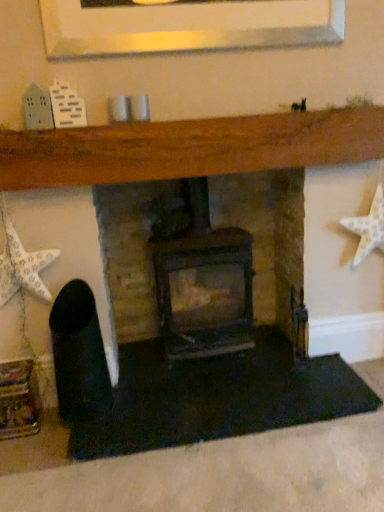
This screenshot has height=512, width=384. Describe the element at coordinates (22, 267) in the screenshot. I see `white paper star at left, which appears as the second starfish when viewed from the right` at that location.

What is the approximate width of white matte starfish at right, the 1th starfish from the right?

white matte starfish at right, the 1th starfish from the right, is 3.70 inches in width.

Describe the element at coordinates (189, 147) in the screenshot. The image size is (384, 512). I see `rustic stone fireplace at center` at that location.

Locate an element on the screen. The width and height of the screenshot is (384, 512). white paper star at left, which appears as the second starfish when viewed from the right is located at coordinates (22, 267).

Considering the sizes of objects dark brown wood burning stove at center and white matte starfish at right, the 2th starfish positioned from the left, in the image provided, who is smaller, dark brown wood burning stove at center or white matte starfish at right, the 2th starfish positioned from the left,?

With smaller size is white matte starfish at right, the 2th starfish positioned from the left.

Can you confirm if dark brown wood burning stove at center is shorter than white matte starfish at right, the 1th starfish from the right?

In fact, dark brown wood burning stove at center may be taller than white matte starfish at right, the 1th starfish from the right.

Can you confirm if dark brown wood burning stove at center is positioned to the left of white matte starfish at right, the 1th starfish from the right?

Correct, you'll find dark brown wood burning stove at center to the left of white matte starfish at right, the 1th starfish from the right.

Consider the image. From a real-world perspective, which object stands above the other?

white matte starfish at right, the 2th starfish positioned from the left, is physically above.

From the image's perspective, who appears lower, rustic stone fireplace at center or white matte starfish at right, the 1th starfish from the right?

From the image's view, rustic stone fireplace at center is below.

Is rustic stone fireplace at center with white matte starfish at right, the 2th starfish positioned from the left?

No, rustic stone fireplace at center is not touching white matte starfish at right, the 2th starfish positioned from the left.

How different are the orientations of rustic stone fireplace at center and white matte starfish at right, the 2th starfish positioned from the left, in degrees?

rustic stone fireplace at center and white matte starfish at right, the 2th starfish positioned from the left, are facing 1.22 degrees away from each other.

In terms of width, does rustic stone fireplace at center look wider or thinner when compared to white matte starfish at right, the 2th starfish positioned from the left?

Considering their sizes, rustic stone fireplace at center looks slimmer than white matte starfish at right, the 2th starfish positioned from the left.

Which is less distant, (245, 138) or (226, 327)?

The point (245, 138) is in front.

How many degrees apart are the facing directions of rustic stone fireplace at center and dark brown wood burning stove at center?

rustic stone fireplace at center and dark brown wood burning stove at center are facing 1.02 degrees away from each other.

Between rustic stone fireplace at center and dark brown wood burning stove at center, which one is positioned behind?

dark brown wood burning stove at center is more distant.

Are rustic stone fireplace at center and dark brown wood burning stove at center far apart?

No, rustic stone fireplace at center is not far from dark brown wood burning stove at center.

From the image's perspective, between white matte starfish at right, the 2th starfish positioned from the left, and dark brown wood burning stove at center, who is located below?

dark brown wood burning stove at center is shown below in the image.

Is white matte starfish at right, the 2th starfish positioned from the left, positioned beyond the bounds of dark brown wood burning stove at center?

Yes, white matte starfish at right, the 2th starfish positioned from the left, is located beyond the bounds of dark brown wood burning stove at center.

Is white matte starfish at right, the 1th starfish from the right, next to dark brown wood burning stove at center?

No, white matte starfish at right, the 1th starfish from the right, is not touching dark brown wood burning stove at center.

Between white paper star at left, which appears as the second starfish when viewed from the right, and rustic stone fireplace at center, which one has smaller size?

With smaller size is white paper star at left, which appears as the second starfish when viewed from the right.

Between white paper star at left, which appears as the second starfish when viewed from the right, and rustic stone fireplace at center, which one has smaller width?

rustic stone fireplace at center is thinner.

Is white paper star at left, which appears as the second starfish when viewed from the right, with rustic stone fireplace at center?

No, white paper star at left, which appears as the second starfish when viewed from the right, is not making contact with rustic stone fireplace at center.

Looking at this image, is white paper star at left, the 1th starfish from the left, facing towards rustic stone fireplace at center?

No, white paper star at left, the 1th starfish from the left, is not oriented towards rustic stone fireplace at center.

Which point is more forward, (x=28, y=446) or (x=31, y=264)?

Positioned in front is point (x=28, y=446).

Looking at this image, how distant is rustic stone fireplace at center from white paper star at left, the 1th starfish from the left?

rustic stone fireplace at center is 20.70 inches from white paper star at left, the 1th starfish from the left.

Looking at the image, does rustic stone fireplace at center seem bigger or smaller compared to white paper star at left, which appears as the second starfish when viewed from the right?

Considering their sizes, rustic stone fireplace at center takes up more space than white paper star at left, which appears as the second starfish when viewed from the right.

Is white matte starfish at right, the 1th starfish from the right, wider than rustic stone fireplace at center?

Indeed, white matte starfish at right, the 1th starfish from the right, has a greater width compared to rustic stone fireplace at center.

Is white matte starfish at right, the 2th starfish positioned from the left, turned away from rustic stone fireplace at center?

Correct, white matte starfish at right, the 2th starfish positioned from the left, is looking away from rustic stone fireplace at center.

Consider the image. Is white matte starfish at right, the 1th starfish from the right, far from rustic stone fireplace at center?

That's not correct — white matte starfish at right, the 1th starfish from the right, is a little close to rustic stone fireplace at center.

Locate an element on the screen. The image size is (384, 512). starfish that appears behind the dark brown wood burning stove at center is located at coordinates (368, 228).

At what (x,y) coordinates should I click in order to perform the action: click on the 1st starfish located above the rustic stone fireplace at center (from a real-world perspective). Please return your answer as a coordinate pair (x, y). This screenshot has height=512, width=384. Looking at the image, I should click on (368, 228).

Consider the image. Based on their spatial positions, is white matte starfish at right, the 2th starfish positioned from the left, or white paper star at left, the 1th starfish from the left, further from dark brown wood burning stove at center?

white matte starfish at right, the 2th starfish positioned from the left, is further to dark brown wood burning stove at center.

From the picture: From the image, which object appears to be nearer to dark brown wood burning stove at center, white matte starfish at right, the 1th starfish from the right, or rustic stone fireplace at center?

Among the two, rustic stone fireplace at center is located nearer to dark brown wood burning stove at center.

Considering their positions, is white paper star at left, the 1th starfish from the left, positioned closer to rustic stone fireplace at center than white matte starfish at right, the 1th starfish from the right?

white paper star at left, the 1th starfish from the left, is closer to rustic stone fireplace at center.

Estimate the real-world distances between objects in this image. Which object is further from rustic stone fireplace at center, dark brown wood burning stove at center or white matte starfish at right, the 2th starfish positioned from the left?

dark brown wood burning stove at center is positioned further to the anchor rustic stone fireplace at center.

Estimate the real-world distances between objects in this image. Which object is further from rustic stone fireplace at center, white paper star at left, which appears as the second starfish when viewed from the right, or dark brown wood burning stove at center?

dark brown wood burning stove at center.

Looking at the image, which one is located further to rustic stone fireplace at center, dark brown wood burning stove at center or white paper star at left, which appears as the second starfish when viewed from the right?

dark brown wood burning stove at center lies further to rustic stone fireplace at center than the other object.

From the image, which object appears to be farther from white matte starfish at right, the 2th starfish positioned from the left, rustic stone fireplace at center or dark brown wood burning stove at center?

dark brown wood burning stove at center is positioned further to the anchor white matte starfish at right, the 2th starfish positioned from the left.

In the scene shown: Which object lies further to the anchor point white paper star at left, the 1th starfish from the left, dark brown wood burning stove at center or white matte starfish at right, the 1th starfish from the right?

white matte starfish at right, the 1th starfish from the right, is positioned further to the anchor white paper star at left, the 1th starfish from the left.

Identify the location of fireplace located between dark brown wood burning stove at center and white matte starfish at right, the 1th starfish from the right, in the left-right direction. Image resolution: width=384 pixels, height=512 pixels. click(189, 147).

Where is `fireplace between white paper star at left, the 1th starfish from the left, and white matte starfish at right, the 2th starfish positioned from the left, in the horizontal direction`? fireplace between white paper star at left, the 1th starfish from the left, and white matte starfish at right, the 2th starfish positioned from the left, in the horizontal direction is located at coordinates (189, 147).

Locate an element on the screen. wood burning stove between white paper star at left, which appears as the second starfish when viewed from the right, and white matte starfish at right, the 2th starfish positioned from the left is located at coordinates (204, 282).

Identify the location of wood burning stove situated between white paper star at left, which appears as the second starfish when viewed from the right, and rustic stone fireplace at center from left to right. (204, 282).